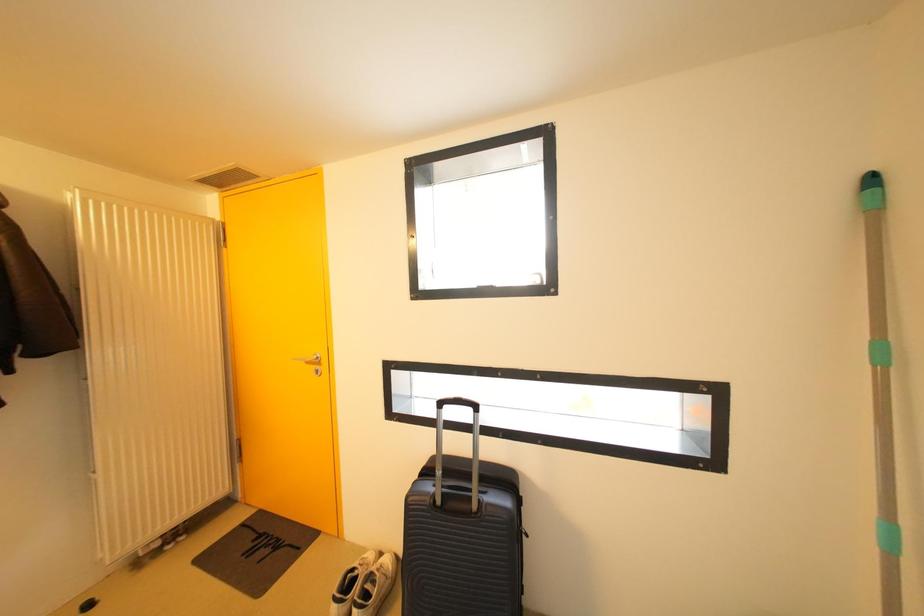
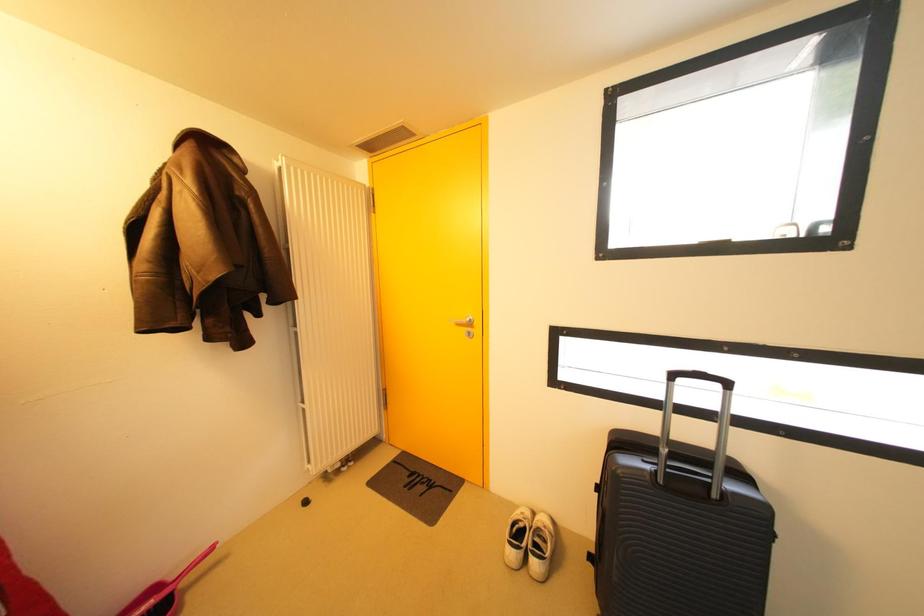
Question: In a continuous first-person perspective shot, in which direction is the camera moving?

Choices:
 (A) Left
 (B) Right
 (C) Forward
 (D) Backward

Answer: (A)